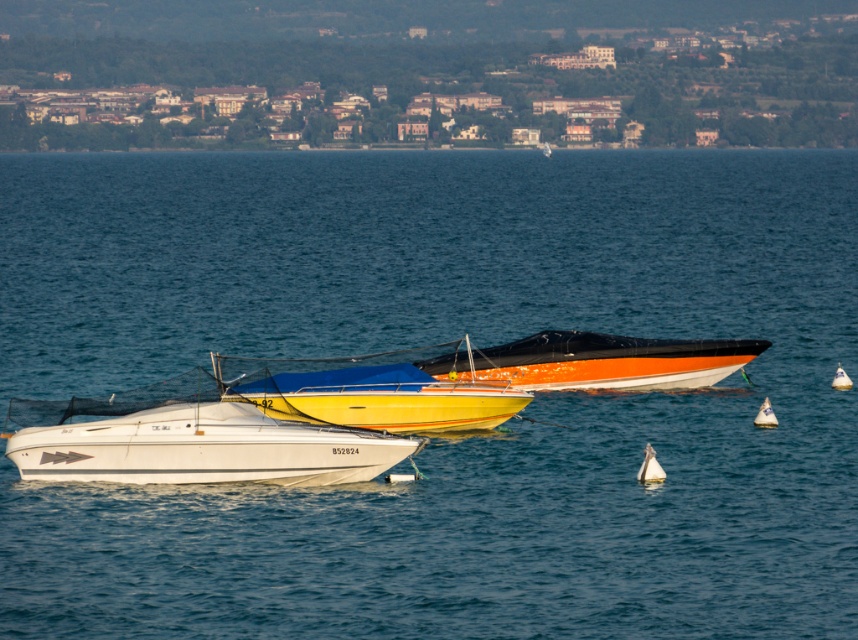
Does yellow matte boat at center appear on the left side of orange glossy boat at center?

Yes, yellow matte boat at center is to the left of orange glossy boat at center.

Is the position of yellow matte boat at center less distant than that of orange glossy boat at center?

Yes, yellow matte boat at center is in front of orange glossy boat at center.

Find the location of a particular element. This screenshot has height=640, width=858. yellow matte boat at center is located at coordinates (372, 394).

How distant is white glossy boat at center from yellow matte boat at center?

11.92 feet

Can you confirm if white glossy boat at center is shorter than yellow matte boat at center?

No.

In order to click on white glossy boat at center in this screenshot , I will do `click(189, 440)`.

Locate an element on the screen. white glossy boat at center is located at coordinates (189, 440).

Who is lower down, white glossy boat at center or orange glossy boat at center?

Positioned lower is white glossy boat at center.

Who is positioned more to the left, white glossy boat at center or orange glossy boat at center?

Positioned to the left is white glossy boat at center.

Between point (321, 467) and point (587, 381), which one is positioned behind?

Point (587, 381)

Image resolution: width=858 pixels, height=640 pixels. I want to click on white glossy boat at center, so click(x=189, y=440).